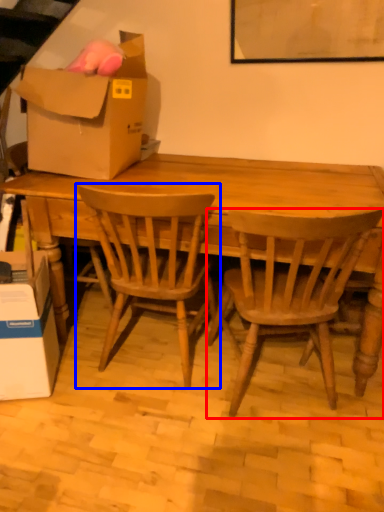
Question: Which object is closer to the camera taking this photo, chair (highlighted by a red box) or chair (highlighted by a blue box)?

Choices:
 (A) chair
 (B) chair

Answer: (A)